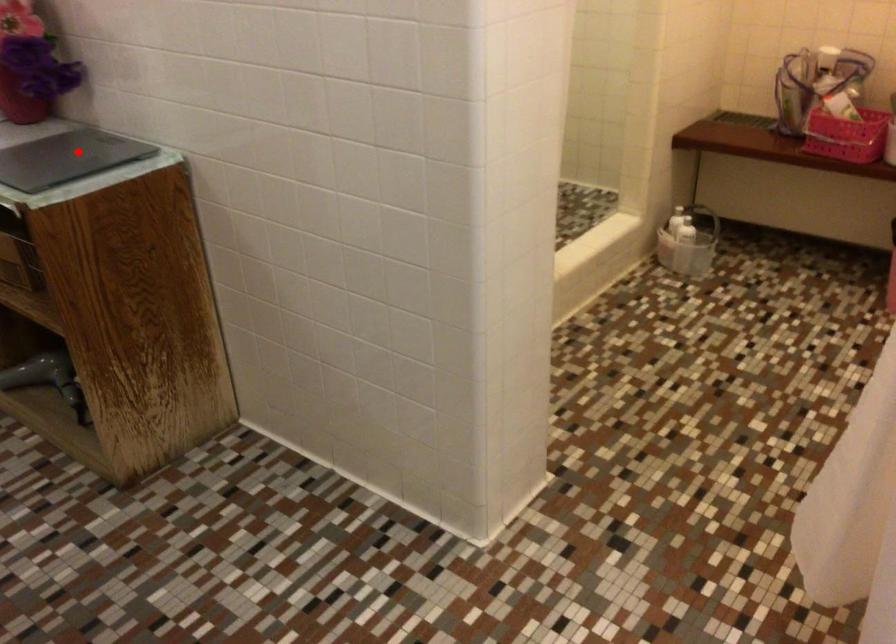
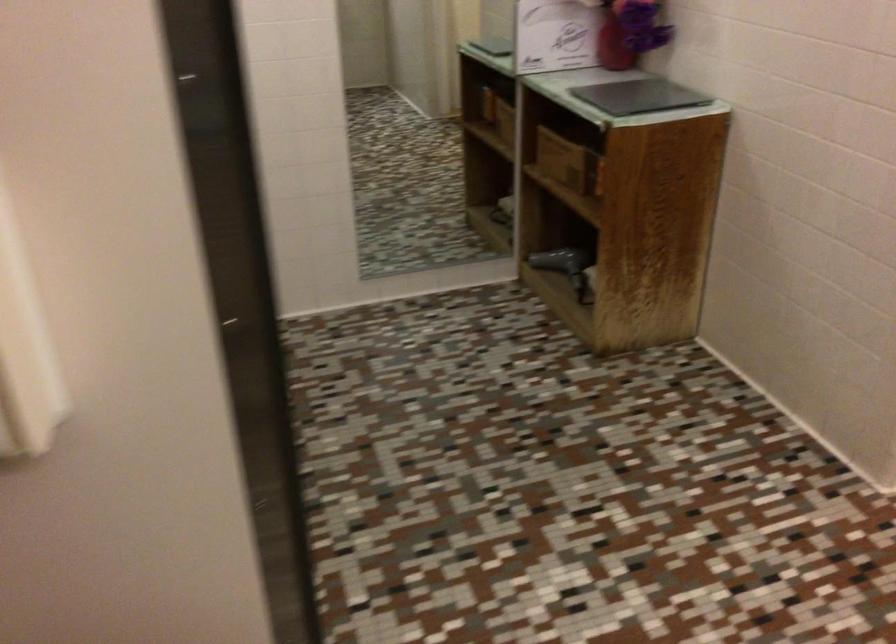
Question: I am providing you with two images of the same scene from different viewpoints. Given a red point in image1, look at the same physical point in image2. Is it:

Choices:
 (A) Closer to the viewpoint
 (B) Farther from the viewpoint

Answer: (B)